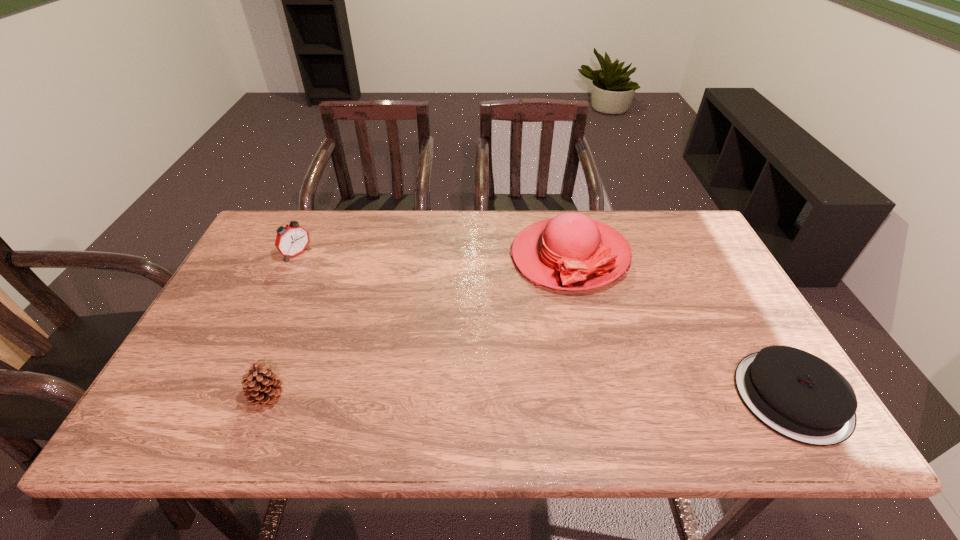
The image size is (960, 540). I want to click on object that is at the far left corner, so click(291, 240).

Find the location of a particular element. This screenshot has width=960, height=540. object located in the near right corner section of the desktop is located at coordinates (799, 396).

Where is `vacant space at the far edge`? The height and width of the screenshot is (540, 960). vacant space at the far edge is located at coordinates (373, 222).

In the image, there is a desktop. Identify the location of vacant space at the near edge. 660,383.

Identify the location of vacant space at the left edge of the desktop. (x=209, y=319).

Locate an element on the screen. The width and height of the screenshot is (960, 540). vacant space at the right edge of the desktop is located at coordinates (730, 357).

Image resolution: width=960 pixels, height=540 pixels. I want to click on vacant area at the far left corner, so click(x=319, y=211).

Where is `vacant space at the far right corner`? This screenshot has height=540, width=960. vacant space at the far right corner is located at coordinates (704, 235).

This screenshot has width=960, height=540. What are the coordinates of `vacant point located between the shortest object and the alarm clock` in the screenshot? It's located at (544, 326).

The image size is (960, 540). I want to click on vacant area that lies between the shortest object and the leftmost object, so click(544, 326).